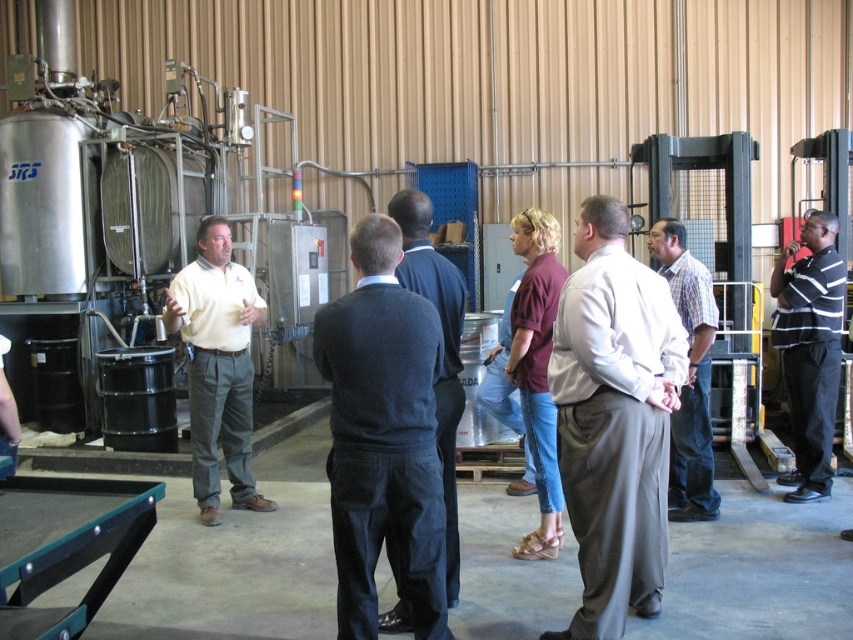
Question: Among these objects, which one is nearest to the camera?

Choices:
 (A) plaid cotton shirt at center
 (B) dark blue sweater at center

Answer: (B)

Question: Is dark blue sweater at center thinner than matte yellow shirt at center?

Choices:
 (A) no
 (B) yes

Answer: (B)

Question: Can you confirm if light gray trousers at center is positioned to the left of plaid cotton shirt at center?

Choices:
 (A) no
 (B) yes

Answer: (B)

Question: Which object is closer to the camera taking this photo?

Choices:
 (A) plaid cotton shirt at center
 (B) dark gray sweater at center

Answer: (B)

Question: Among these objects, which one is nearest to the camera?

Choices:
 (A) matte yellow shirt at center
 (B) light gray trousers at center
 (C) dark gray sweater at center
 (D) black striped shirt at right

Answer: (C)

Question: Is dark blue sweater at center in front of black striped shirt at right?

Choices:
 (A) no
 (B) yes

Answer: (B)